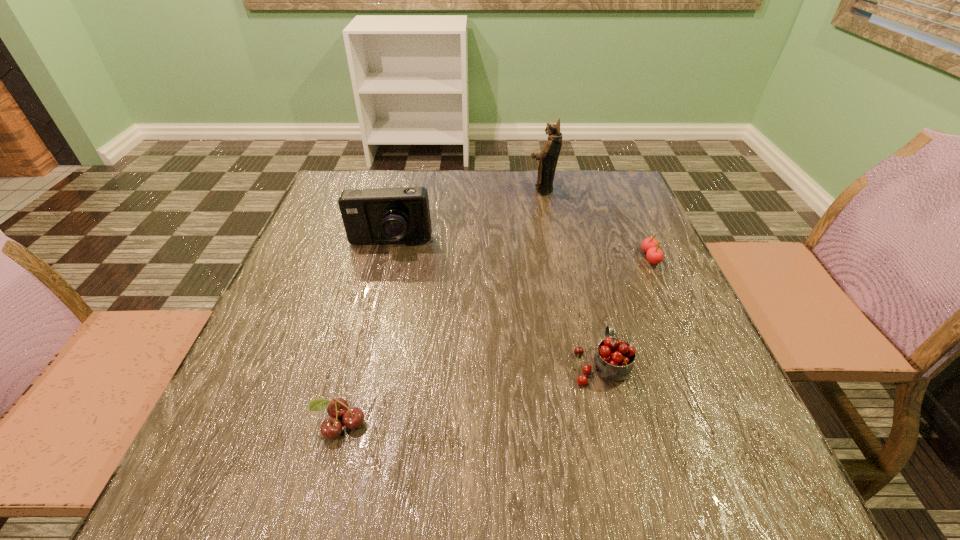
Where is `the tallest object`? the tallest object is located at coordinates (548, 157).

I want to click on figurine, so click(x=548, y=157).

Identify the location of the second tallest object. The height and width of the screenshot is (540, 960). (383, 215).

Identify the location of the second nearest object. The height and width of the screenshot is (540, 960). (613, 360).

At what (x,y) coordinates should I click in order to perform the action: click on the third tallest object. Please return your answer as a coordinate pair (x, y). The image size is (960, 540). Looking at the image, I should click on (613, 360).

The height and width of the screenshot is (540, 960). Find the location of `the nearest cherry`. the nearest cherry is located at coordinates (331, 428).

The width and height of the screenshot is (960, 540). I want to click on the nearest object, so click(x=331, y=428).

Locate an element on the screen. the farthest cherry is located at coordinates (650, 245).

Image resolution: width=960 pixels, height=540 pixels. What are the coordinates of `the rightmost object` in the screenshot? It's located at (650, 245).

Image resolution: width=960 pixels, height=540 pixels. In order to click on blank area located 0.070m on the front-facing side of the farthest object in this screenshot , I will do `click(503, 189)`.